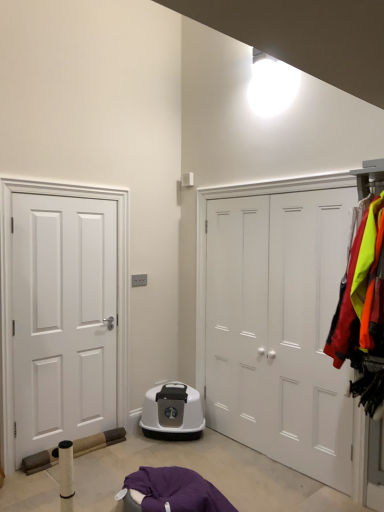
Question: Considering the relative positions of white matte door at center, the 2th door from the left, and reflective nylon jackets at right in the image provided, is white matte door at center, the 2th door from the left, to the left or to the right of reflective nylon jackets at right?

Choices:
 (A) right
 (B) left

Answer: (B)

Question: Is point (319, 398) closer or farther from the camera than point (377, 248)?

Choices:
 (A) farther
 (B) closer

Answer: (A)

Question: Estimate the real-world distances between objects in this image. Which object is farther from the reflective nylon jackets at right?

Choices:
 (A) white matte door at center, the 1th door from the right
 (B) white matte door at left, positioned as the first door in left-to-right order

Answer: (B)

Question: Which object is positioned farthest from the white matte door at left, the 2th door in the right-to-left sequence?

Choices:
 (A) white matte door at center, the 2th door from the left
 (B) reflective nylon jackets at right

Answer: (B)